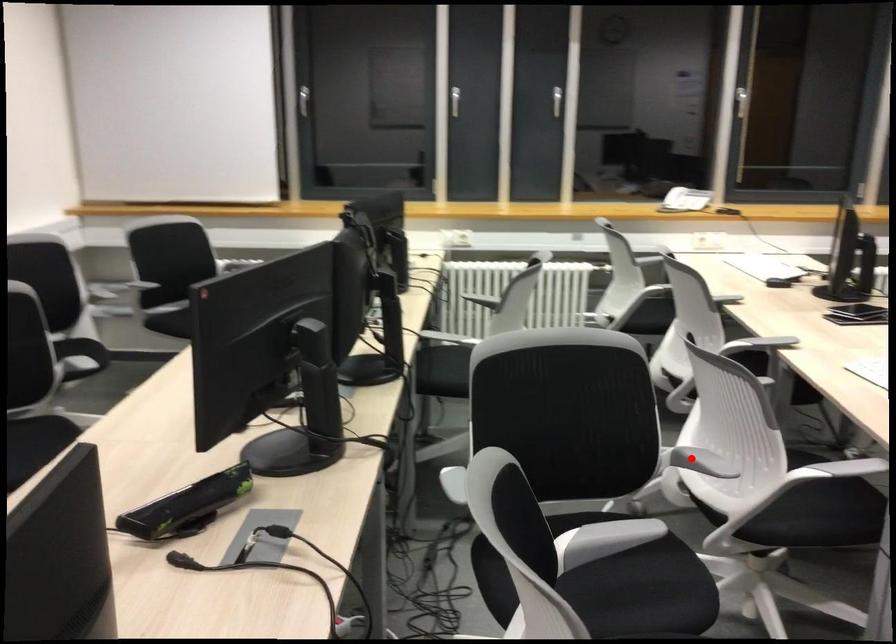
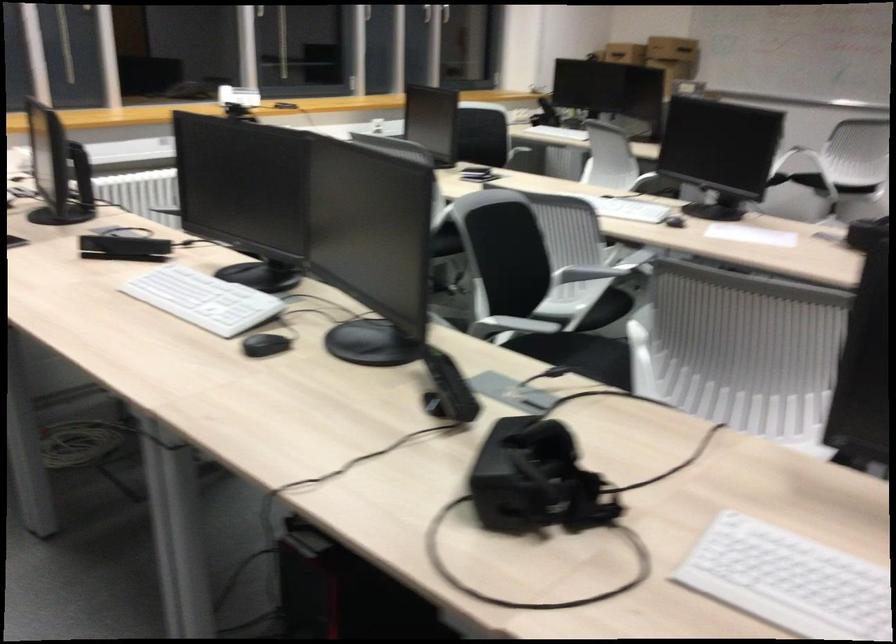
Question: I am providing you with two images of the same scene from different viewpoints. A red point is marked on the first image. Is the red point's position out of view in image 2?

Choices:
 (A) Yes
 (B) No

Answer: (B)